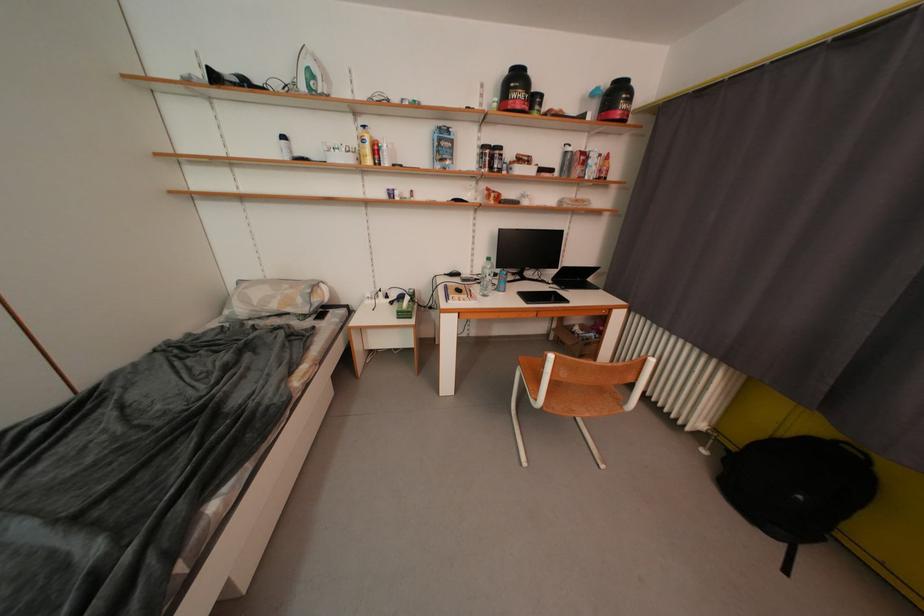
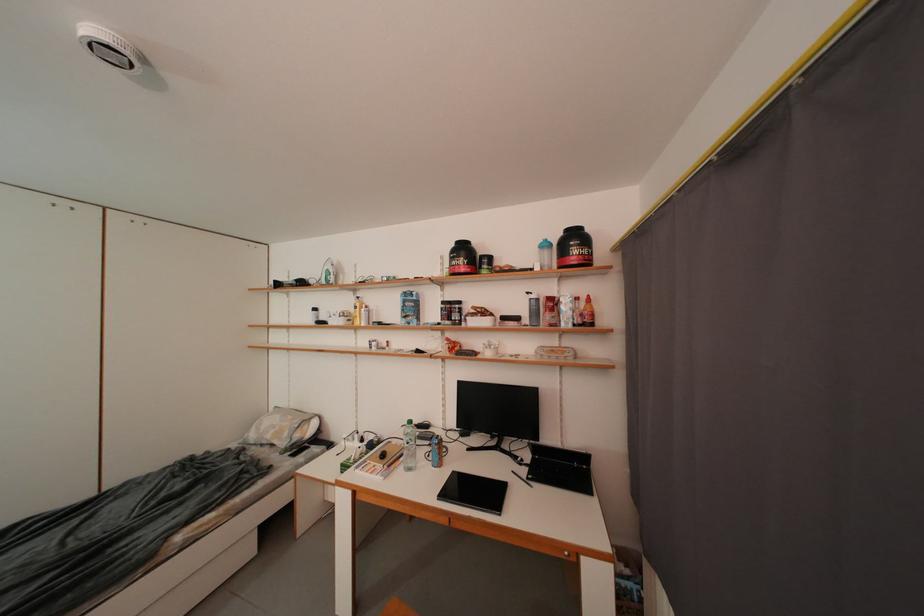
Where in the second image is the point corresponding to (608,174) from the first image?

(590, 318)